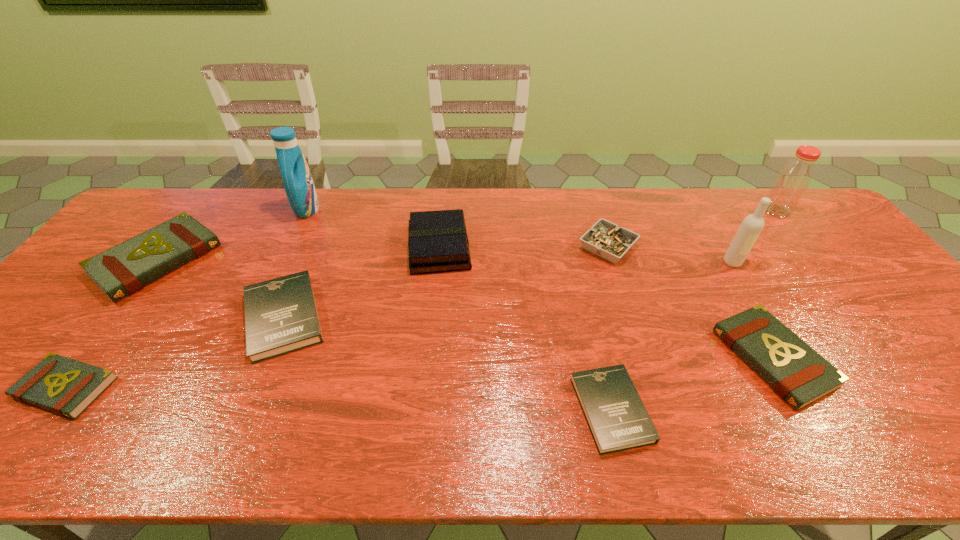
This screenshot has height=540, width=960. Identify the location of detergent. (297, 179).

Identify the location of the rightmost object. (792, 181).

The height and width of the screenshot is (540, 960). I want to click on red bottle, so click(792, 181).

Where is `white vodka`? This screenshot has width=960, height=540. white vodka is located at coordinates (752, 225).

Locate an element on the screen. Image resolution: width=960 pixels, height=540 pixels. the third book from right to left is located at coordinates (438, 242).

Identify the location of the fifth object from left to right. (438, 242).

Where is `the second tallest book`? The width and height of the screenshot is (960, 540). the second tallest book is located at coordinates (124, 269).

In order to click on the biggest brown book in this screenshot , I will do `click(124, 269)`.

You are a GUI agent. You are given a task and a screenshot of the screen. Output one action in this format:
    pyautogui.click(x=<x>, y=<y>)
    Task: Click on the gray ashtray
    This screenshot has width=960, height=540.
    Given the screenshot: What is the action you would take?
    pyautogui.click(x=605, y=239)

I want to click on the second biggest brown book, so click(797, 373).